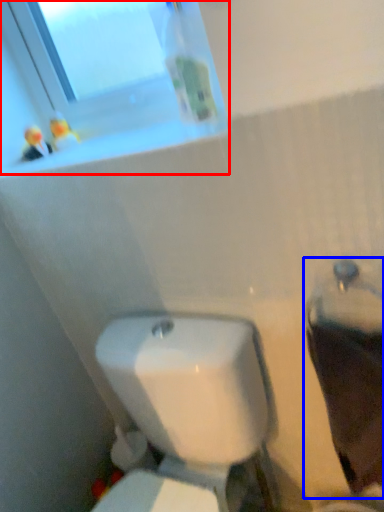
Question: Which object is closer to the camera taking this photo, window (highlighted by a red box) or porcelain (highlighted by a blue box)?

Choices:
 (A) window
 (B) porcelain

Answer: (B)